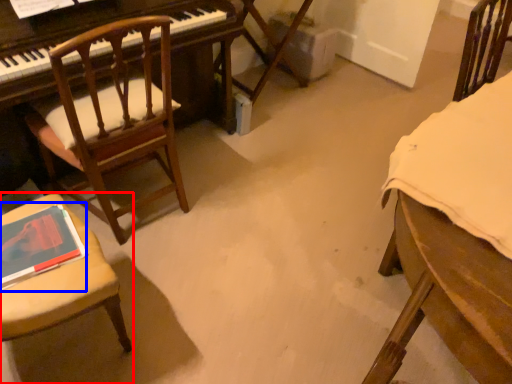
Question: Which of the following is the closest to the observer, chair (highlighted by a red box) or book (highlighted by a blue box)?

Choices:
 (A) chair
 (B) book

Answer: (A)